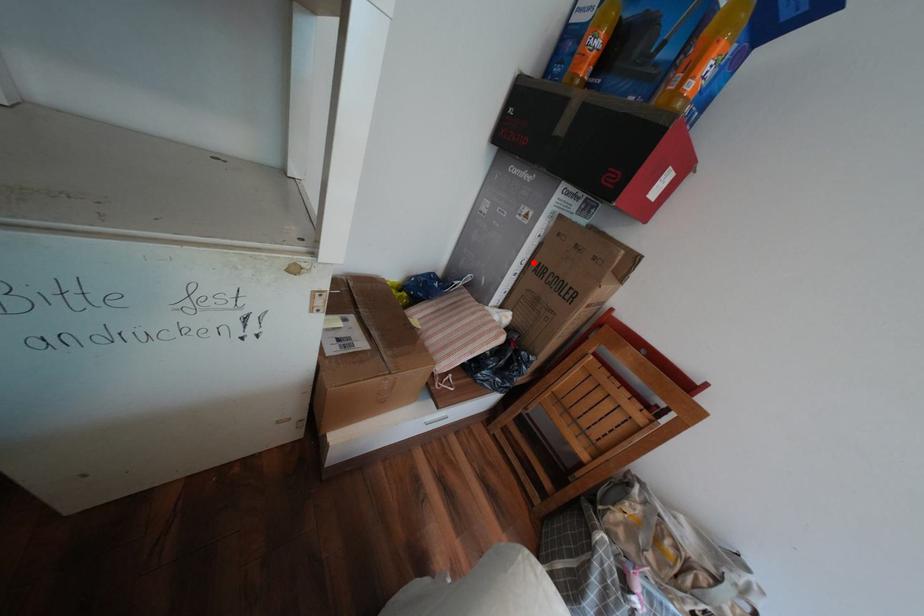
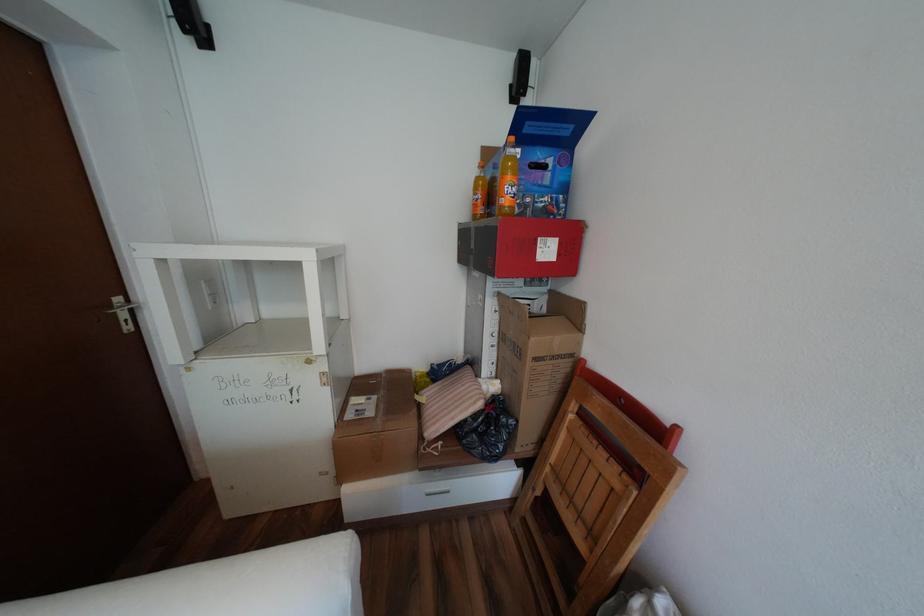
Locate, in the second image, the point that corresponds to the highlighted location in the first image.

(505, 334)